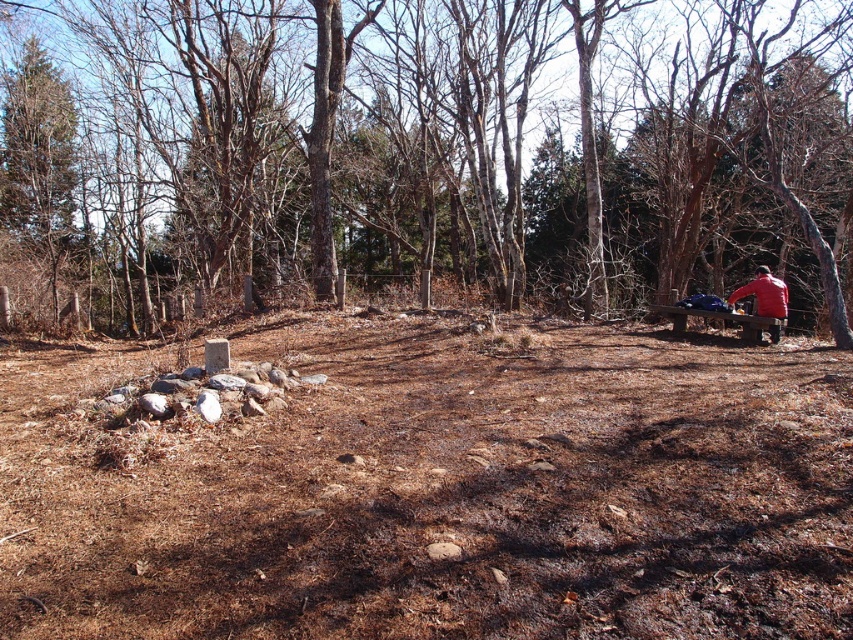
You are an outdoor enthusiast planning to take a photo of the brown bark tree at center and the red matte jacket at right. Since you want both subjects to appear equally sized in the photo, which object should you move closer to and which should you move farther away from?

The brown bark tree at center is wider than the red matte jacket at right. To make them appear the same size in the photo, move closer to the red matte jacket at right and move farther away from the brown bark tree at center.

Based on the scene description, what is located at the coordinates point (428, 148)?

A brown bark tree at center is located at point (428, 148).